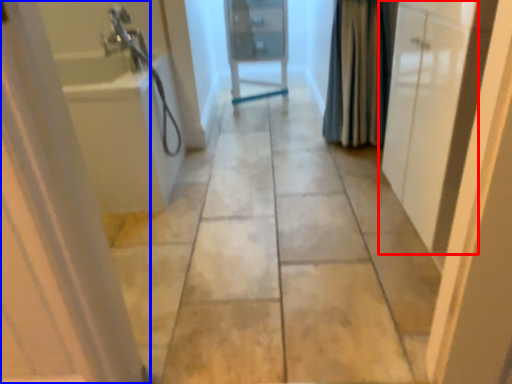
Question: Among these objects, which one is farthest to the camera, door (highlighted by a red box) or door (highlighted by a blue box)?

Choices:
 (A) door
 (B) door

Answer: (A)